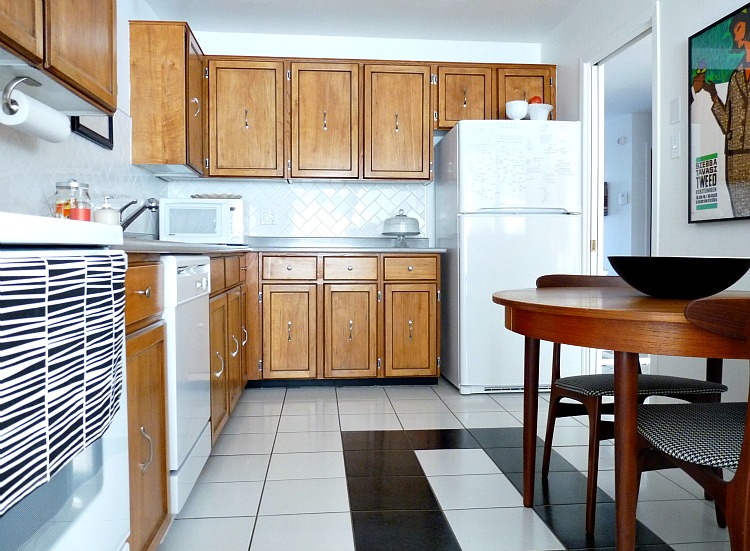
At what (x,y) coordinates should I click in order to perform the action: click on chairs. Please return your answer as a coordinate pair (x, y). Looking at the image, I should click on (712, 429).